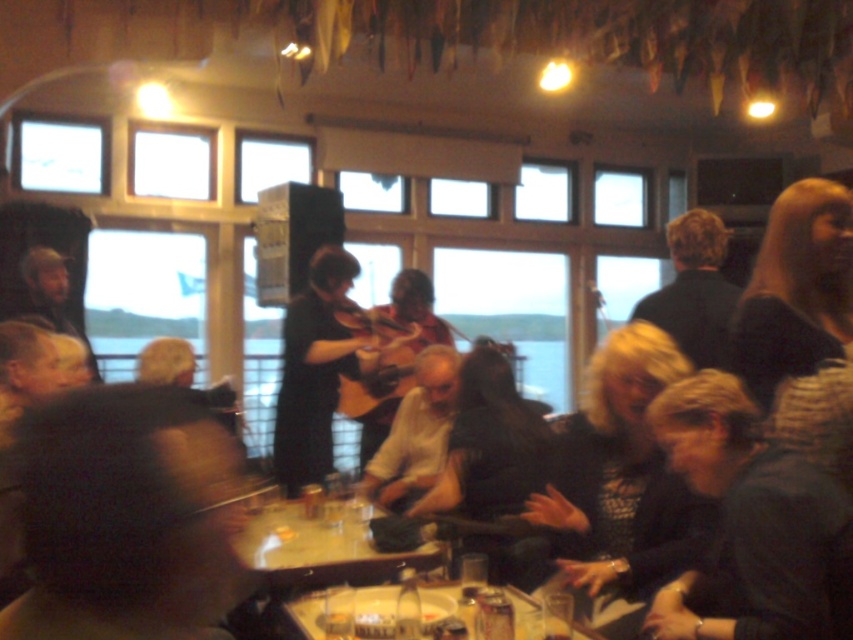
You are a photographer trying to capture a clear image of both the dark gray sweater at lower right and the black matte shirt at upper right. Since the scene is blurred, you decide to adjust your camera settings to focus on one subject first. Which item should you focus on first to ensure it appears sharp in the final photo?

The dark gray sweater at lower right has a larger width than the black matte shirt at upper right. Therefore, focusing on the dark gray sweater at lower right first would ensure its details are captured sharply before adjusting for the smaller black matte shirt at upper right.

You are standing in the bar and want to reach a specific point in the scene to take a photo. The point you need to reach is located at coordinates point (828, 621). Given that you are currently 2 meters away from the camera, can you determine if you are closer to or farther from that point than the camera?

The distance of point (828, 621) from the camera is 1.83 meters. Since you are currently 2 meters away from the camera, you are farther from the point than the camera is.

You are a photographer trying to capture a clear shot of the dark gray sweater at center and the blonde hair at upper center in this blurry image. Based on their positions, which subject is more likely to be in focus if you adjust the camera focus to the foreground?

The dark gray sweater at center is much taller than blonde hair at upper center, so adjusting the focus to the foreground would likely keep the dark gray sweater at center in focus while the blonde hair at upper center may be out of focus due to its shorter height and position further back.